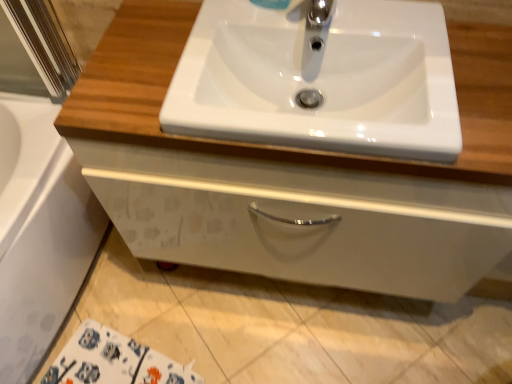
Question: Can you confirm if white glossy cabinet at center is thinner than white glossy sink at center?

Choices:
 (A) no
 (B) yes

Answer: (A)

Question: Does white glossy cabinet at center turn towards white glossy sink at center?

Choices:
 (A) yes
 (B) no

Answer: (B)

Question: From a real-world perspective, is white glossy cabinet at center below white glossy sink at center?

Choices:
 (A) yes
 (B) no

Answer: (A)

Question: Is white glossy sink at center inside white glossy cabinet at center?

Choices:
 (A) no
 (B) yes

Answer: (B)

Question: Is white glossy cabinet at center bigger than white glossy sink at center?

Choices:
 (A) no
 (B) yes

Answer: (B)

Question: From a real-world perspective, is white glossy cabinet at center positioned over white glossy sink at center based on gravity?

Choices:
 (A) no
 (B) yes

Answer: (A)

Question: Is white glossy bath at lower left outside of chrome metallic faucet at upper center?

Choices:
 (A) no
 (B) yes

Answer: (B)

Question: Is white glossy bath at lower left at the right side of chrome metallic faucet at upper center?

Choices:
 (A) yes
 (B) no

Answer: (B)

Question: Can you confirm if white glossy bath at lower left is smaller than chrome metallic faucet at upper center?

Choices:
 (A) yes
 (B) no

Answer: (B)

Question: Is the surface of white glossy bath at lower left in direct contact with chrome metallic faucet at upper center?

Choices:
 (A) no
 (B) yes

Answer: (A)

Question: Can you confirm if white glossy bath at lower left is shorter than chrome metallic faucet at upper center?

Choices:
 (A) yes
 (B) no

Answer: (B)

Question: Considering the relative sizes of white glossy bath at lower left and chrome metallic faucet at upper center in the image provided, is white glossy bath at lower left taller than chrome metallic faucet at upper center?

Choices:
 (A) yes
 (B) no

Answer: (A)

Question: Is chrome metallic faucet at upper center facing away from white glossy cabinet at center?

Choices:
 (A) yes
 (B) no

Answer: (B)